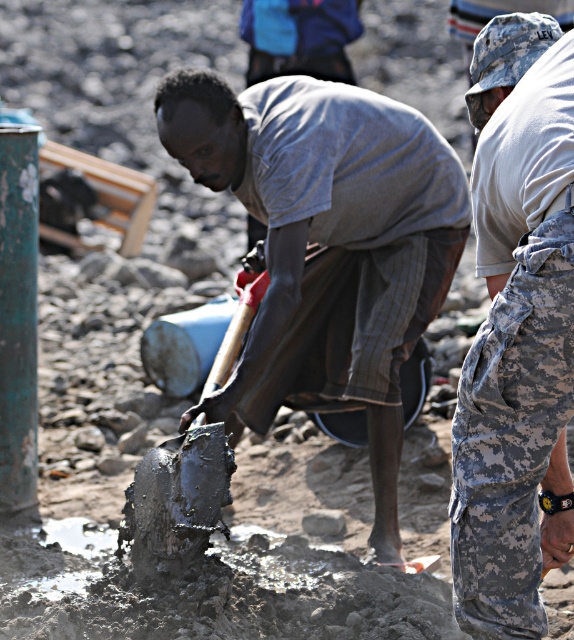
Based on the scene description, which object is taller between the matte gray shirt at center and the camouflage pants at right?

The matte gray shirt at center is taller than camouflage pants at right according to the description.

You are standing at the origin point in the image. Where is the matte gray shirt at center located in terms of coordinates?

The matte gray shirt at center is located at coordinates point (327, 244).

You are a photographer trying to capture both the matte gray shirt at center and the camouflage pants at right in a single frame. Given their sizes, which object should you focus on to ensure both are clearly visible in the photo?

The matte gray shirt at center is larger in size than camouflage pants at right, so focusing on the matte gray shirt at center will help ensure both are clearly visible in the photo.